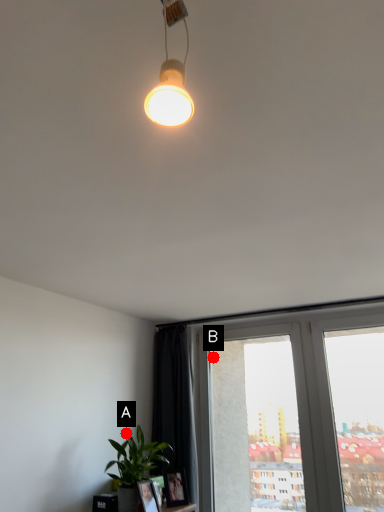
Question: Two points are circled on the image, labeled by A and B beside each circle. Which point is closer to the camera?

Choices:
 (A) A is closer
 (B) B is closer

Answer: (A)